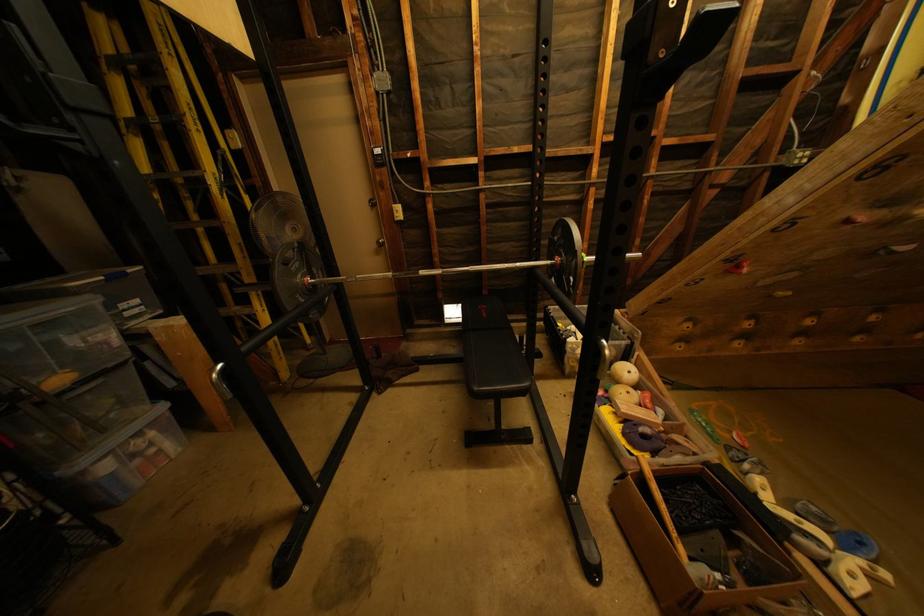
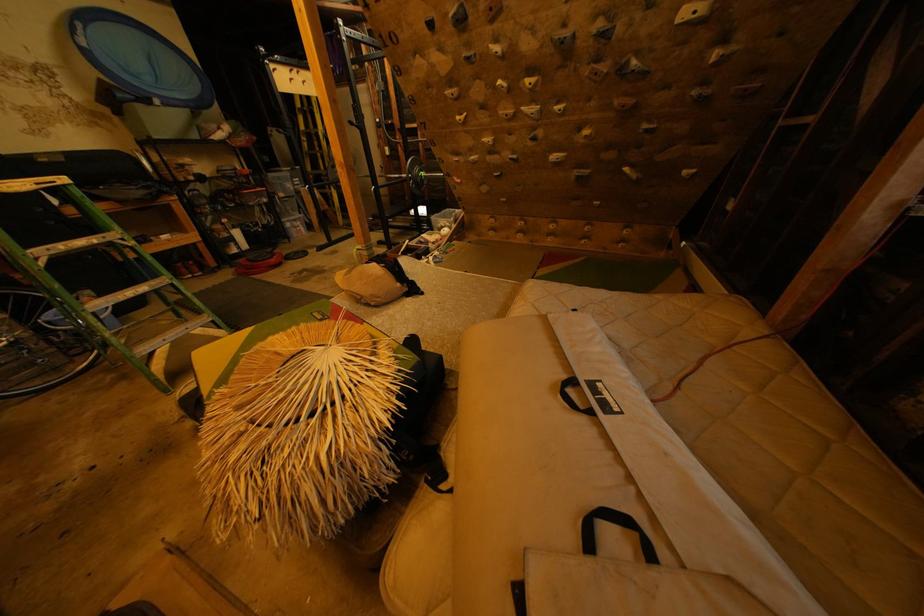
What movement of the cameraman would produce the second image?

The movement direction of the cameraman is right, backward.